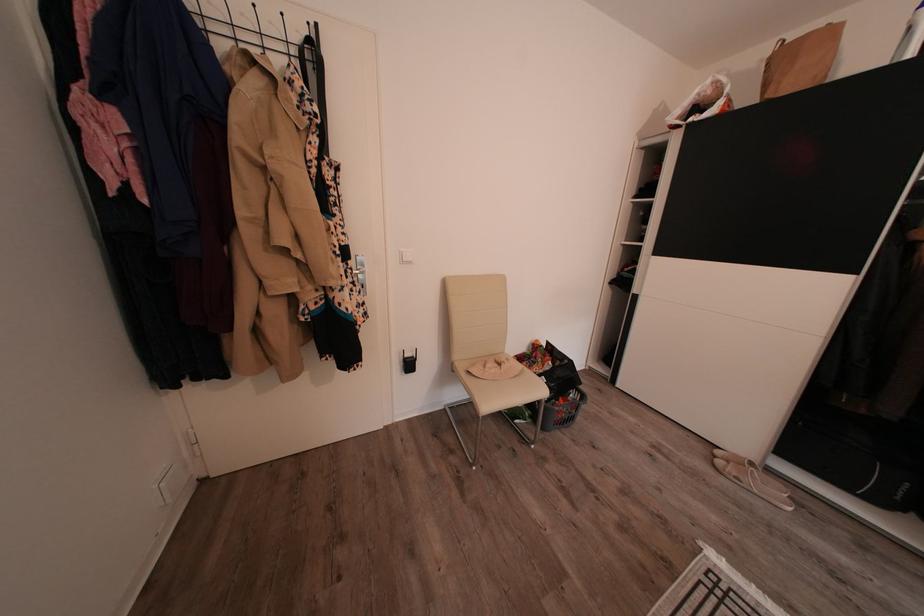
I want to click on chair sitting surface, so click(x=493, y=368).